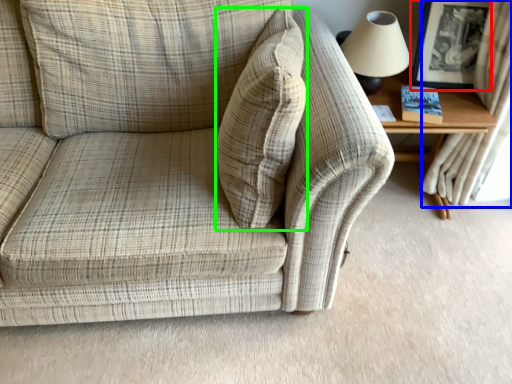
Question: Which object is positioned closest to picture frame (highlighted by a red box)? Select from curtain (highlighted by a blue box) and throw pillow (highlighted by a green box).

Choices:
 (A) curtain
 (B) throw pillow

Answer: (A)